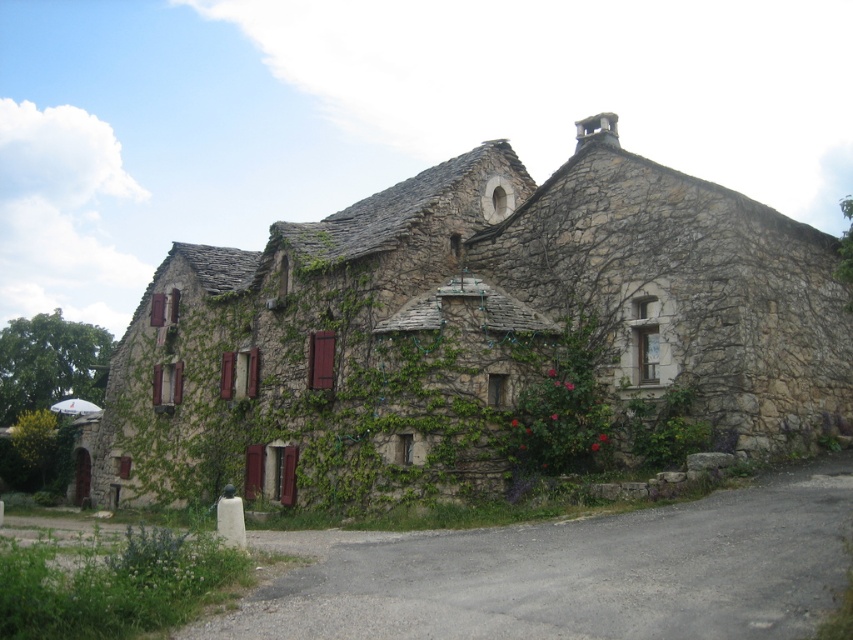
You are standing in a rural area and see the natural stone cottage at center. If you want to find its exact location on a map, what coordinates should you note down?

The natural stone cottage at center is located at point [477,337], so you should note down these coordinates.

In the scene shown: You are a delivery person standing at the entrance of the natural stone cottage at center. You need to deliver a package to a mailbox that is 167.16 feet away from the cottage. Is this distance within the range of a standard delivery drone that has a maximum range of 200 feet?

The mailbox is 167.16 feet away from the natural stone cottage at center, which is within the 200 feet maximum range of the drone. Therefore, the delivery can be made using the drone.